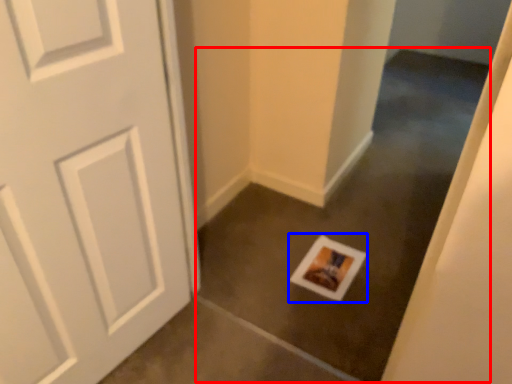
Question: Which object is closer to the camera taking this photo, concrete (highlighted by a red box) or postcard (highlighted by a blue box)?

Choices:
 (A) concrete
 (B) postcard

Answer: (A)